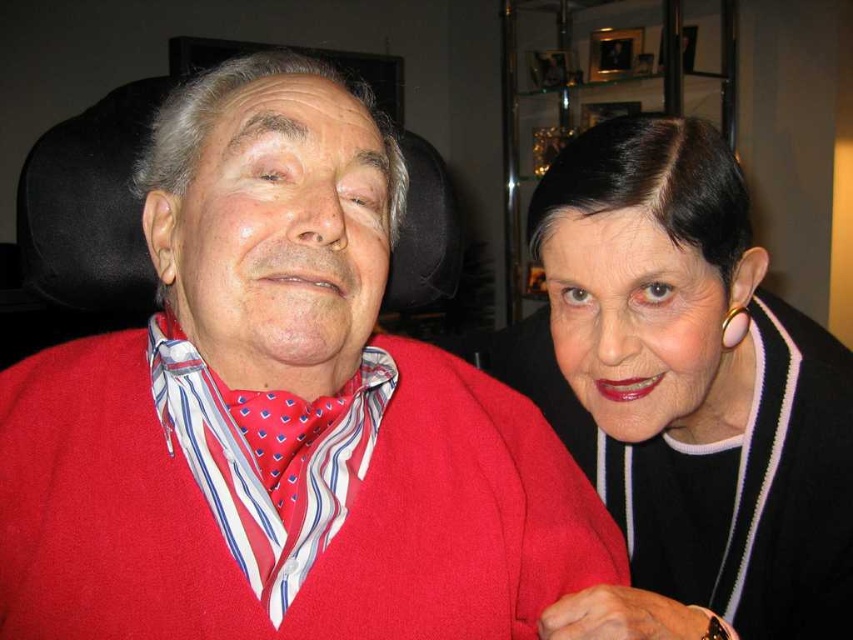
You are a tailor measuring the distance between two sweaters for a client. The client wants to know if the distance between the matte red sweater at center and the black matte sweater at upper right is sufficient to place a 7.5 inch wide decorative plaque between them. Can you confirm if there is enough space?

The distance between the matte red sweater at center and the black matte sweater at upper right is 7.68 inches. Since the plaque is 7.5 inches wide, there is enough space between them to place the plaque.

You are standing in the room and want to take a closer look at the point located at coordinates point (16, 429). Given that the camera is positioned at your eye level, can you estimate whether this point is within arm reach without moving your feet?

The point (16, 429) is 23.13 inches away from the camera, which is within typical arm reach distance. Therefore, you can likely touch it without moving your feet.